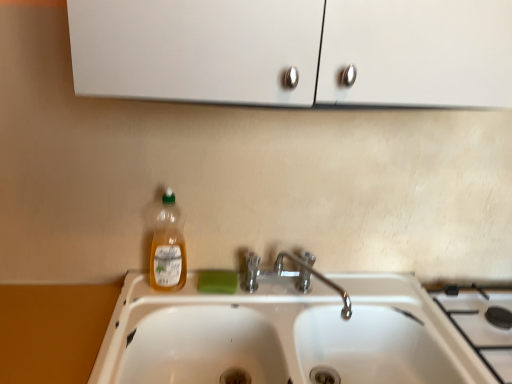
The height and width of the screenshot is (384, 512). What are the coordinates of `vacant area that lies to the right of translucent plastic bottle at center` in the screenshot? It's located at (207, 291).